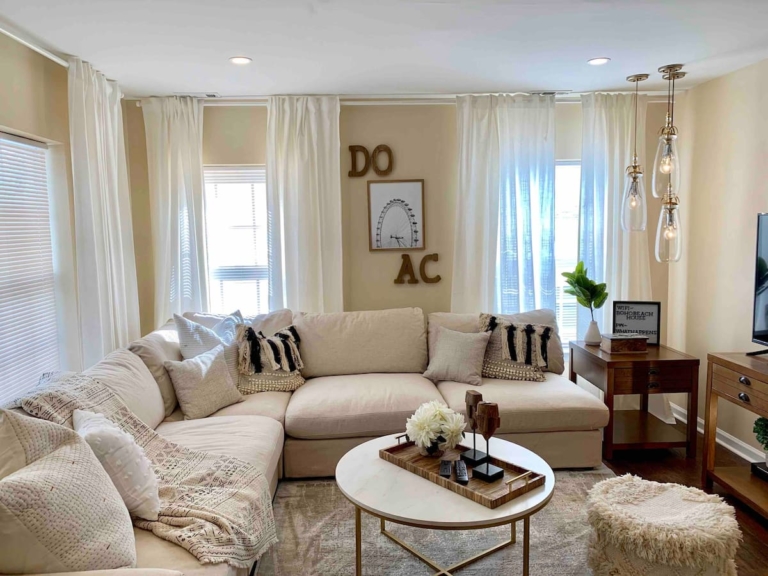
This screenshot has width=768, height=576. What are the coordinates of `couch` in the screenshot? It's located at pos(234,443), pos(379,396).